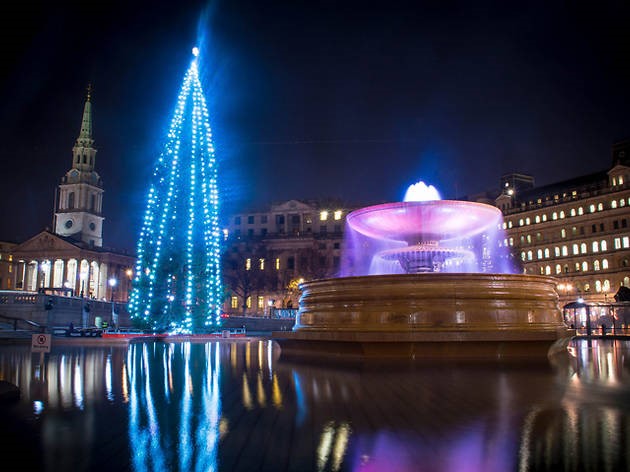
Where is `led lights`? This screenshot has width=630, height=472. led lights is located at coordinates (193, 147).